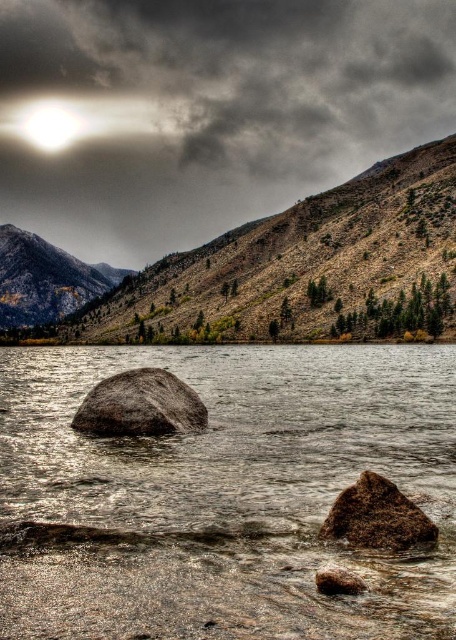
Question: Is dark gray cloud at upper center to the right of brown rough rock at lower center from the viewer's perspective?

Choices:
 (A) yes
 (B) no

Answer: (B)

Question: Which of the following is the closest to the observer?

Choices:
 (A) brown mossy rock at lower center
 (B) bright white light at upper left
 (C) smooth gray rock at center

Answer: (C)

Question: Does rugged brown mountain at upper left appear over rough gray rock at center?

Choices:
 (A) no
 (B) yes

Answer: (B)

Question: Which object appears closest to the camera in this image?

Choices:
 (A) brown rough rock at lower center
 (B) smooth gray rock at center

Answer: (B)

Question: Which is farther from the bright white light at upper left?

Choices:
 (A) brown mossy rock at lower center
 (B) brown/dry grassy hillside at upper center
 (C) brown rough rock at lower center
 (D) smooth gray rock at center

Answer: (A)

Question: Considering the relative positions of smooth gray rock at center and rugged brown mountain at upper left in the image provided, where is smooth gray rock at center located with respect to rugged brown mountain at upper left?

Choices:
 (A) left
 (B) right

Answer: (B)